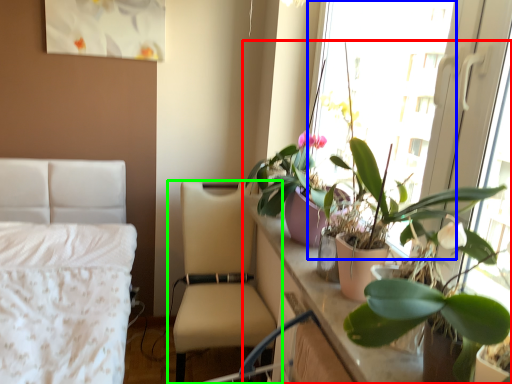
Question: Which object is positioned farthest from houseplant (highlighted by a red box)? Select from window screen (highlighted by a blue box) and chair (highlighted by a green box).

Choices:
 (A) window screen
 (B) chair

Answer: (B)